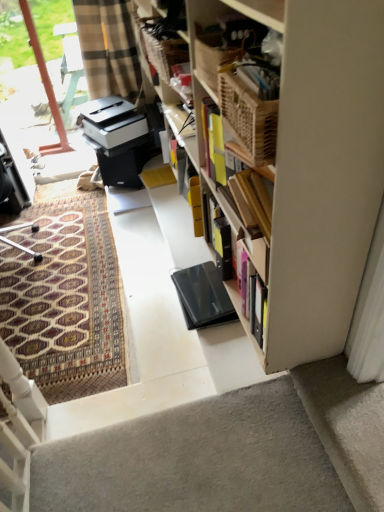
This screenshot has width=384, height=512. What are the coordinates of `blank space situated above black matte laptop at center (from a real-world perspective)` in the screenshot? It's located at (199, 290).